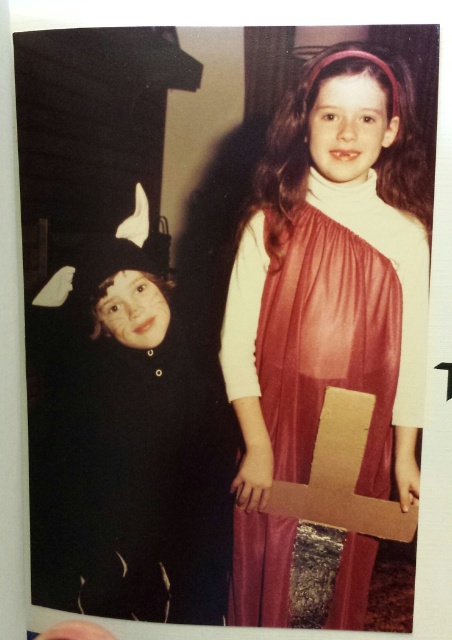
Question: Is shiny red dress at center below black felt costume at left?

Choices:
 (A) yes
 (B) no

Answer: (B)

Question: Can you confirm if shiny red dress at center is wider than black felt costume at left?

Choices:
 (A) no
 (B) yes

Answer: (A)

Question: Does shiny red dress at center have a larger size compared to black felt costume at left?

Choices:
 (A) yes
 (B) no

Answer: (A)